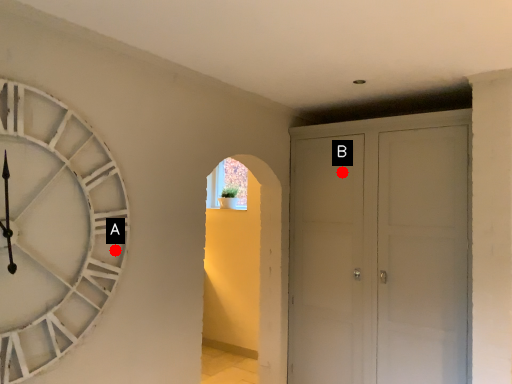
Question: Two points are circled on the image, labeled by A and B beside each circle. Which of the following is the farthest from the observer?

Choices:
 (A) A is further
 (B) B is further

Answer: (B)